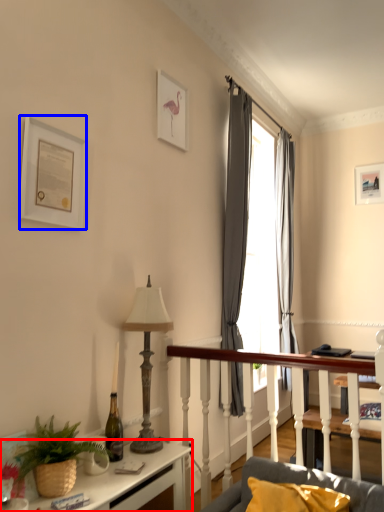
Question: Which object is closer to the camera taking this photo, desk (highlighted by a red box) or picture frame (highlighted by a blue box)?

Choices:
 (A) desk
 (B) picture frame

Answer: (A)